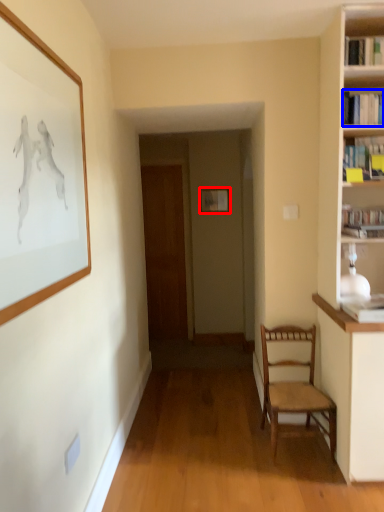
Question: Which object is closer to the camera taking this photo, picture frame (highlighted by a red box) or book (highlighted by a blue box)?

Choices:
 (A) picture frame
 (B) book

Answer: (B)